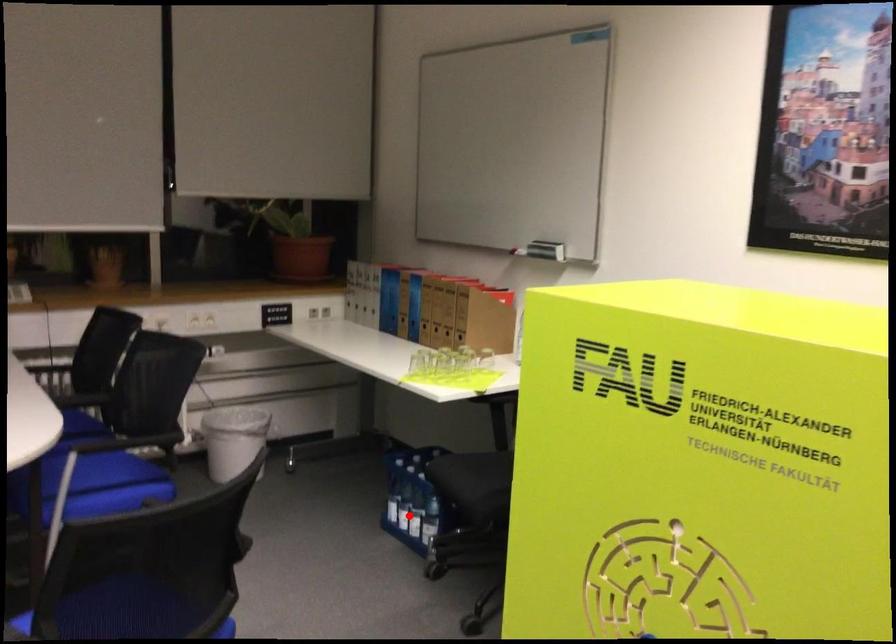
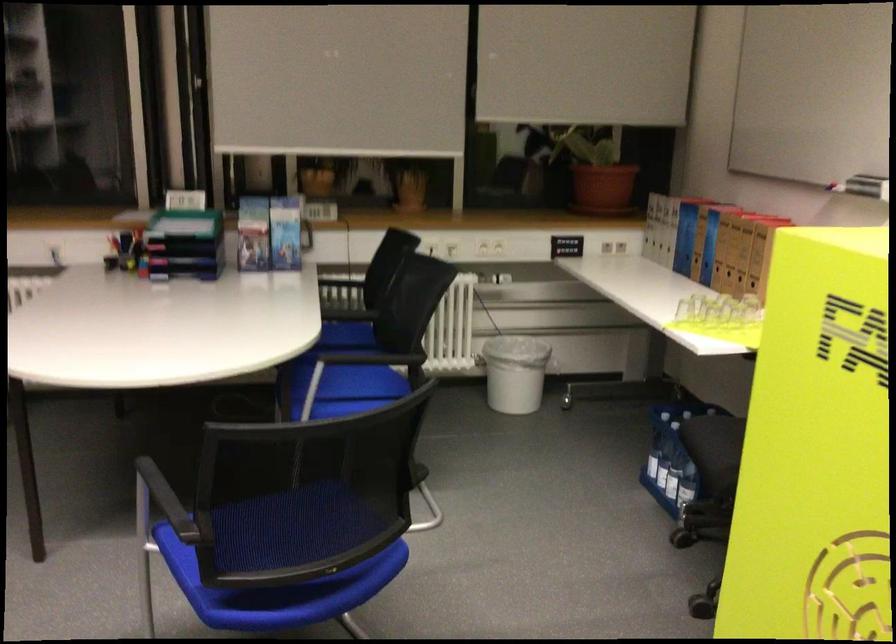
The point at the highlighted location is marked in the first image. Where is the corresponding point in the second image?

(667, 471)